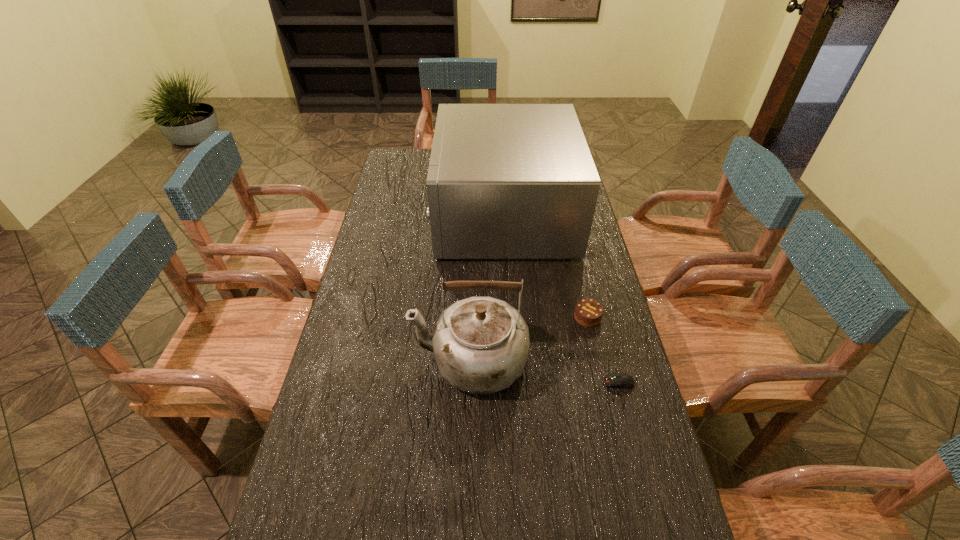
I want to click on vacant space located on the front of the chocolate cake, so click(x=617, y=446).

The width and height of the screenshot is (960, 540). In order to click on vacant space located 0.130m on the button of the shortest object in this screenshot , I will do `click(558, 382)`.

The image size is (960, 540). Identify the location of vacant region located 0.140m on the button of the shortest object. (554, 382).

At what (x,y) coordinates should I click in order to perform the action: click on vacant space located 0.270m on the button of the shortest object. Please return your answer as a coordinate pair (x, y). The width and height of the screenshot is (960, 540). Looking at the image, I should click on (507, 382).

Locate an element on the screen. microwave oven that is at the right edge is located at coordinates (505, 181).

Identify the location of chocolate cake that is positioned at the right edge. (588, 312).

You are a GUI agent. You are given a task and a screenshot of the screen. Output one action in this format:
    pyautogui.click(x=<x>, y=<y>)
    Task: Click on the computer equipment present at the right edge
    This screenshot has height=540, width=960.
    Given the screenshot: What is the action you would take?
    pyautogui.click(x=620, y=380)

Identify the location of vacant space at the left edge of the desktop. The width and height of the screenshot is (960, 540). (392, 176).

This screenshot has width=960, height=540. I want to click on free space at the right edge of the desktop, so click(x=627, y=512).

Locate an element on the screen. free region at the far left corner of the desktop is located at coordinates (406, 167).